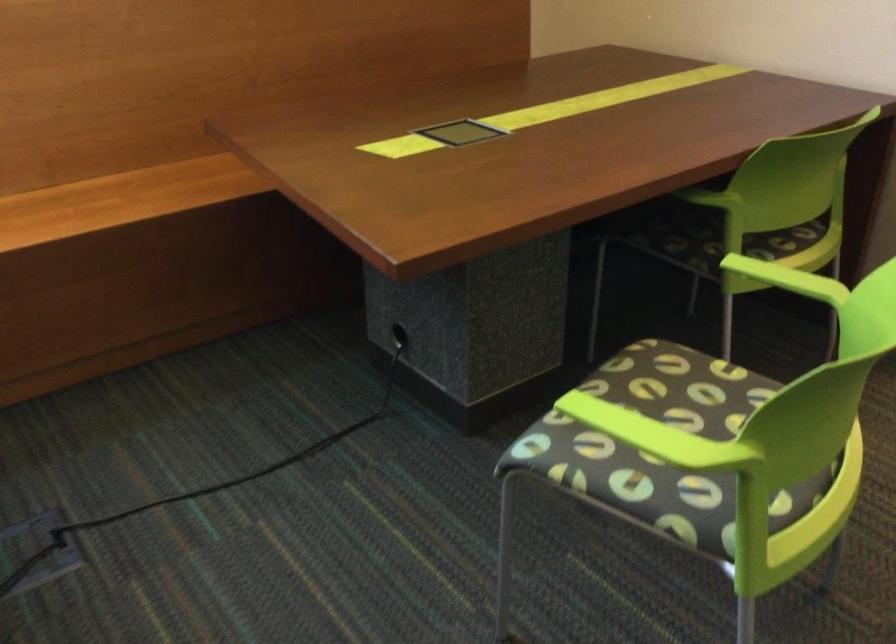
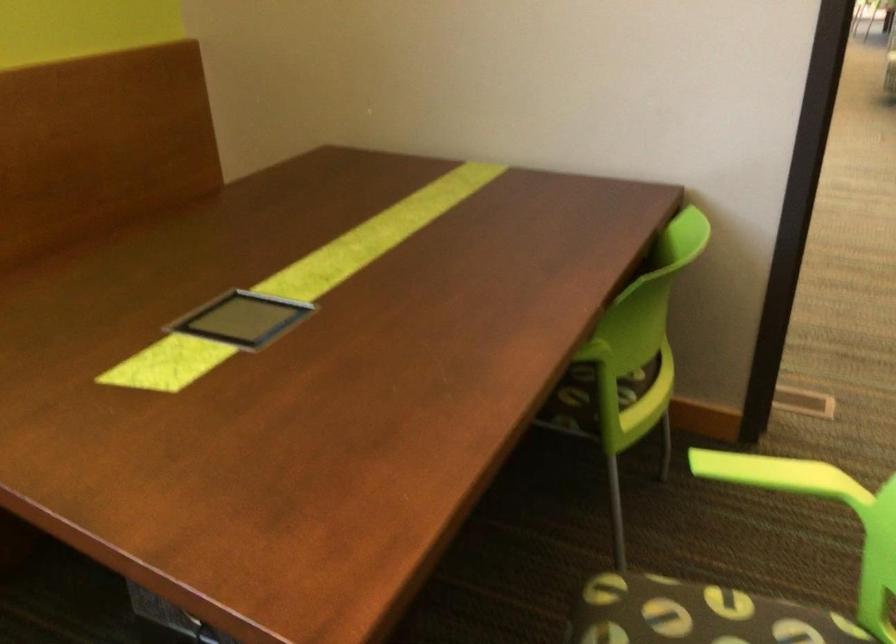
Question: The images are taken continuously from a first-person perspective. In which direction is your viewpoint rotating?

Choices:
 (A) Left
 (B) Right
 (C) Up
 (D) Down

Answer: (B)